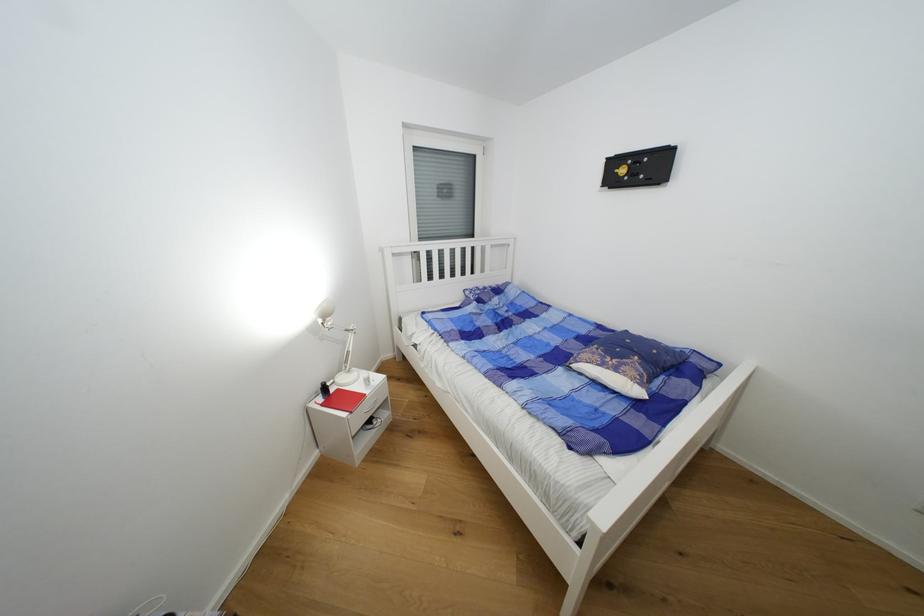
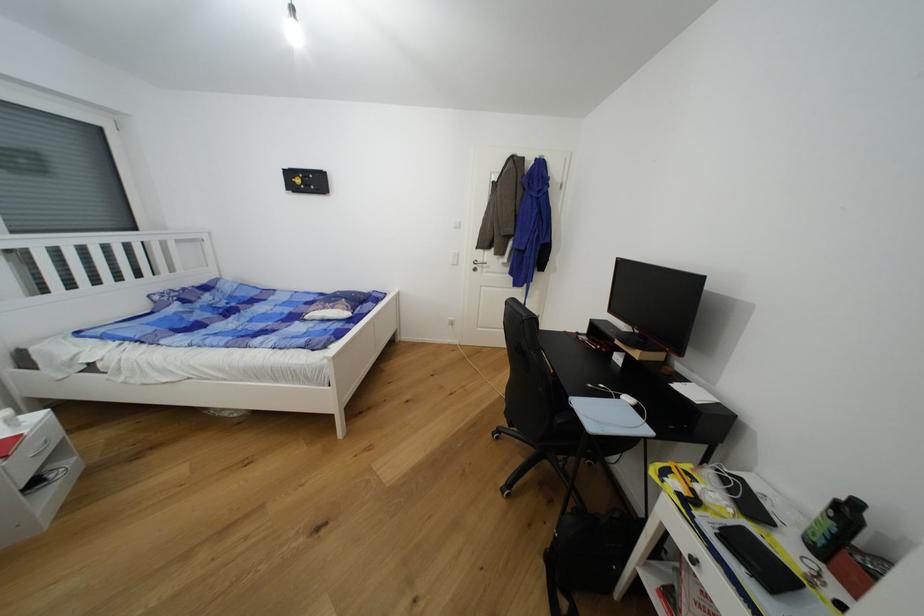
Question: The camera is either moving clockwise (left) or counter-clockwise (right) around the object. The first image is from the beginning of the video and the second image is from the end. Is the camera moving left or right when shooting the video?

Choices:
 (A) Left
 (B) Right

Answer: (A)